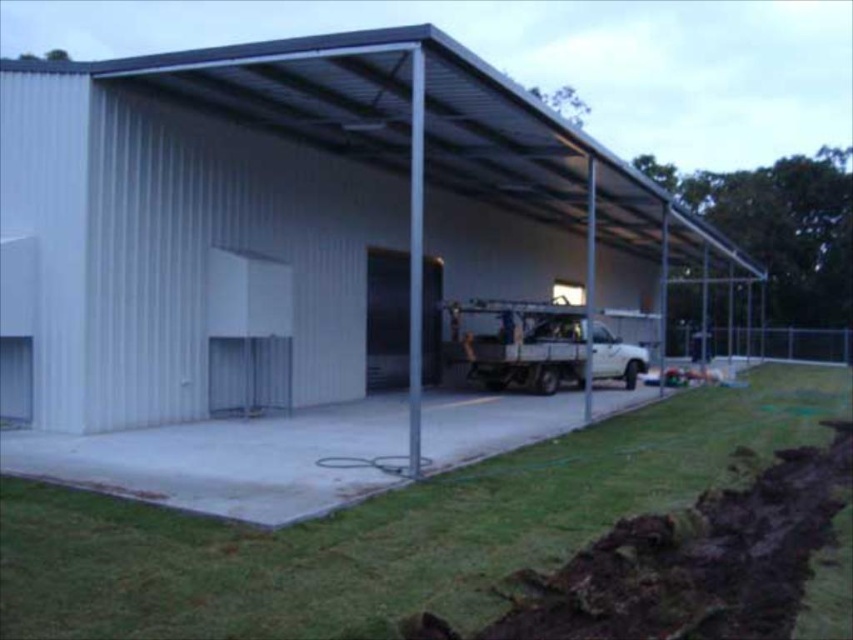
Question: Among these points, which one is nearest to the camera?

Choices:
 (A) (395, 580)
 (B) (386, 298)
 (C) (451, 346)

Answer: (A)

Question: Is white matte truck at center above satin silver door at center?

Choices:
 (A) no
 (B) yes

Answer: (A)

Question: Can you confirm if gray concrete pavement at center is thinner than satin silver door at center?

Choices:
 (A) no
 (B) yes

Answer: (A)

Question: Among these points, which one is farthest from the camera?

Choices:
 (A) (119, 502)
 (B) (625, 342)
 (C) (399, 365)
 (D) (338, 276)

Answer: (B)

Question: Does white corrugated metal building at center appear under white matte truck at center?

Choices:
 (A) yes
 (B) no

Answer: (B)

Question: Which of these objects is positioned closest to the white corrugated metal building at center?

Choices:
 (A) white matte truck at center
 (B) satin silver door at center

Answer: (A)